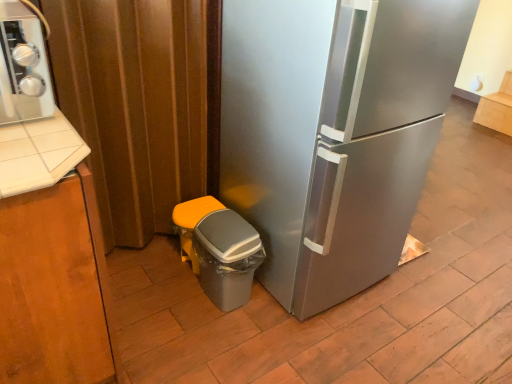
Question: Is matte wood cabinet at upper right, placed as the first cabinetry when sorted from top to bottom, shorter than matte brown curtain at left?

Choices:
 (A) no
 (B) yes

Answer: (B)

Question: Does matte wood cabinet at upper right, placed as the 2th cabinetry when sorted from bottom to top, have a smaller size compared to matte brown curtain at left?

Choices:
 (A) no
 (B) yes

Answer: (B)

Question: Is matte wood cabinet at upper right, the second cabinetry when ordered from left to right, oriented away from matte brown curtain at left?

Choices:
 (A) yes
 (B) no

Answer: (B)

Question: Is matte wood cabinet at upper right, the 1th cabinetry positioned from the right, located outside matte brown curtain at left?

Choices:
 (A) no
 (B) yes

Answer: (B)

Question: Does matte wood cabinet at upper right, placed as the 1th cabinetry when sorted from back to front, have a lesser width compared to matte brown curtain at left?

Choices:
 (A) no
 (B) yes

Answer: (A)

Question: Is matte wood cabinet at upper right, placed as the 2th cabinetry when sorted from bottom to top, directly adjacent to matte brown curtain at left?

Choices:
 (A) no
 (B) yes

Answer: (A)

Question: Is there a large distance between gray plastic trash can at lower left and brushed metal stove at upper left?

Choices:
 (A) no
 (B) yes

Answer: (A)

Question: Is gray plastic trash can at lower left bigger than brushed metal stove at upper left?

Choices:
 (A) no
 (B) yes

Answer: (A)

Question: Is brushed metal stove at upper left at the back of gray plastic trash can at lower left?

Choices:
 (A) no
 (B) yes

Answer: (A)

Question: Is gray plastic trash can at lower left shorter than brushed metal stove at upper left?

Choices:
 (A) yes
 (B) no

Answer: (A)

Question: From the image's perspective, does gray plastic trash can at lower left appear higher than brushed metal stove at upper left?

Choices:
 (A) no
 (B) yes

Answer: (A)

Question: Is gray plastic trash can at lower left facing towards brushed metal stove at upper left?

Choices:
 (A) yes
 (B) no

Answer: (B)

Question: Is matte wood cabinet at upper right, placed as the 2th cabinetry when sorted from bottom to top, placed right next to gray plastic trash can at lower left?

Choices:
 (A) yes
 (B) no

Answer: (B)